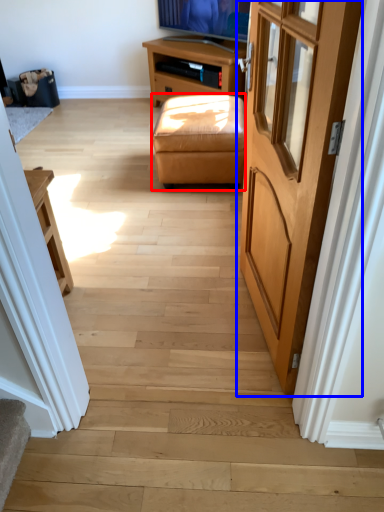
Question: Which of the following is the farthest to the observer, stool (highlighted by a red box) or door (highlighted by a blue box)?

Choices:
 (A) stool
 (B) door

Answer: (A)